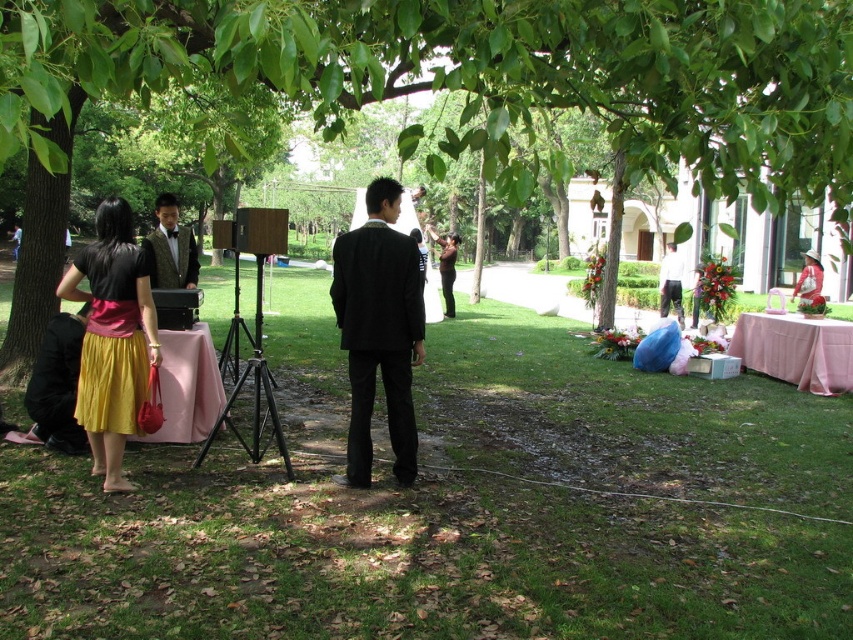
Question: Which object is closer to the camera taking this photo?

Choices:
 (A) green leafy tree at center
 (B) shiny black vest at center
 (C) black matte suit at center

Answer: (A)

Question: Can you confirm if green leafy tree at center is positioned to the left of yellow satin dress at lower left?

Choices:
 (A) yes
 (B) no

Answer: (B)

Question: Which object appears farthest from the camera in this image?

Choices:
 (A) white fabric dress at center
 (B) yellow satin skirt at lower left
 (C) green leafy tree at center

Answer: (A)

Question: In this image, where is yellow satin dress at lower left located relative to shiny black vest at center?

Choices:
 (A) above
 (B) below

Answer: (B)

Question: Which object is closer to the camera taking this photo?

Choices:
 (A) white fabric dress at center
 (B) white matte shirt at center
 (C) black matte suit at center
 (D) shiny black vest at center

Answer: (D)

Question: Can you confirm if shiny black vest at center is wider than white fabric dress at center?

Choices:
 (A) yes
 (B) no

Answer: (B)